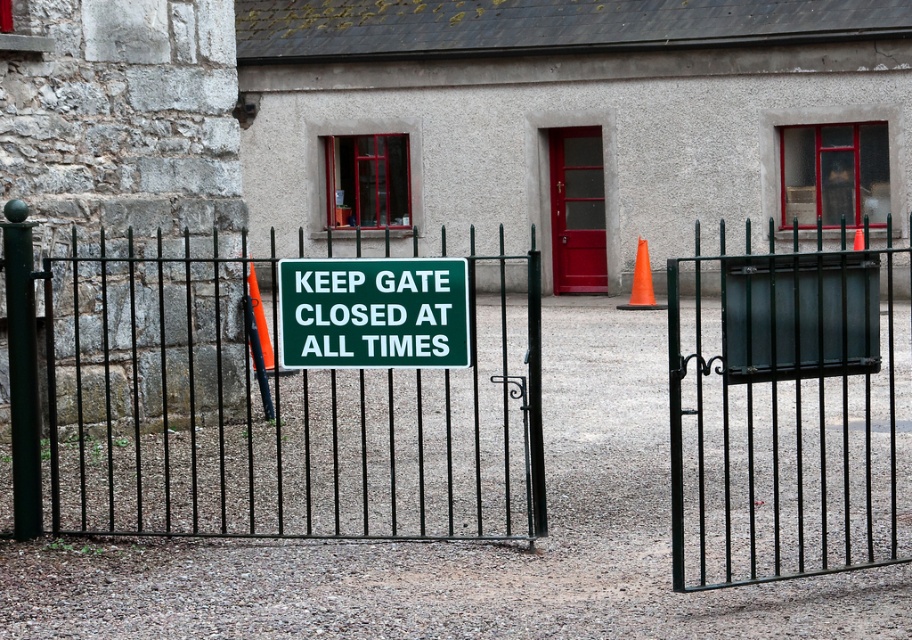
Question: Is black metal gate at center below orange plastic traffic cone at center?

Choices:
 (A) no
 (B) yes

Answer: (A)

Question: Among these points, which one is farthest from the camera?

Choices:
 (A) (392, 355)
 (B) (803, 378)
 (C) (256, 296)
 (D) (651, 289)

Answer: (D)

Question: Does green matte sign at center have a lesser width compared to orange plastic traffic cone at center?

Choices:
 (A) no
 (B) yes

Answer: (A)

Question: Estimate the real-world distances between objects in this image. Which object is farther from the green wrought iron gate at center?

Choices:
 (A) black metal gate at center
 (B) red glossy door at center

Answer: (B)

Question: Is orange matte traffic cone at center-right positioned in front of orange plastic traffic cone at center?

Choices:
 (A) no
 (B) yes

Answer: (A)

Question: Based on their relative distances, which object is nearer to the orange plastic traffic cone at center?

Choices:
 (A) orange matte traffic cone at center-right
 (B) red glossy door at center

Answer: (A)